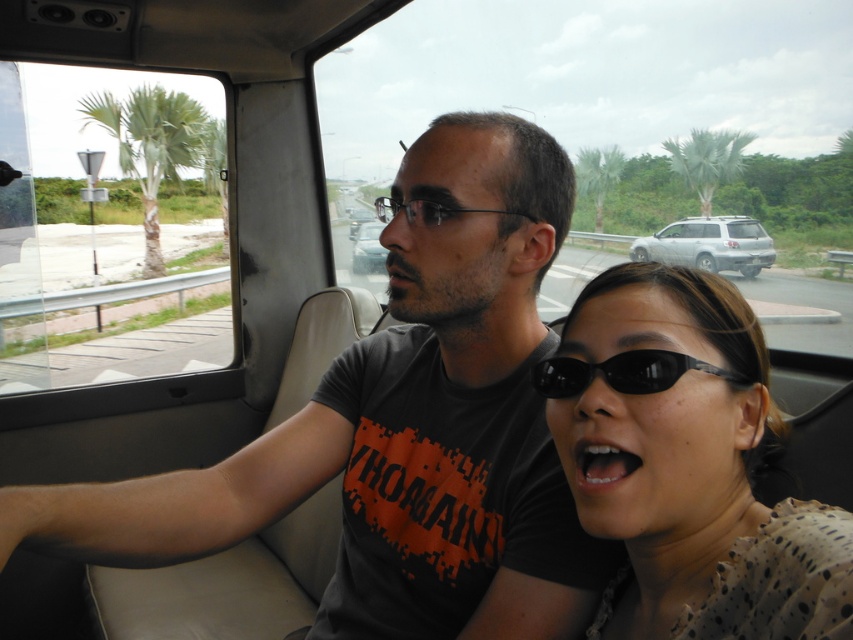
Can you confirm if satin silver suv at center is positioned below black plastic sunglasses at center?

No.

In order to click on satin silver suv at center in this screenshot , I will do [x=709, y=244].

Identify the location of satin silver suv at center. (709, 244).

Is dark gray t-shirt at center wider than green leafy palm tree at upper center?

No, dark gray t-shirt at center is not wider than green leafy palm tree at upper center.

Which is more to the left, dark gray t-shirt at center or green leafy palm tree at upper center?

Positioned to the left is dark gray t-shirt at center.

Locate an element on the screen. Image resolution: width=853 pixels, height=640 pixels. dark gray t-shirt at center is located at coordinates (402, 429).

The width and height of the screenshot is (853, 640). I want to click on dark gray t-shirt at center, so click(402, 429).

Who is lower down, satin silver suv at center or matte black phone at center?

matte black phone at center is lower down.

This screenshot has height=640, width=853. I want to click on satin silver suv at center, so click(709, 244).